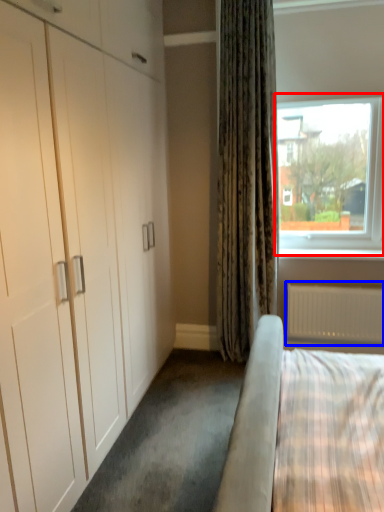
Question: Which object is closer to the camera taking this photo, window (highlighted by a red box) or radiator (highlighted by a blue box)?

Choices:
 (A) window
 (B) radiator

Answer: (A)